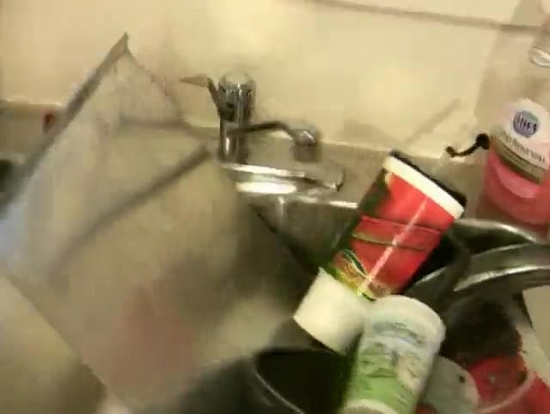
The image size is (550, 414). What are the coordinates of `dish soap bottle` in the screenshot? It's located at (540, 124).